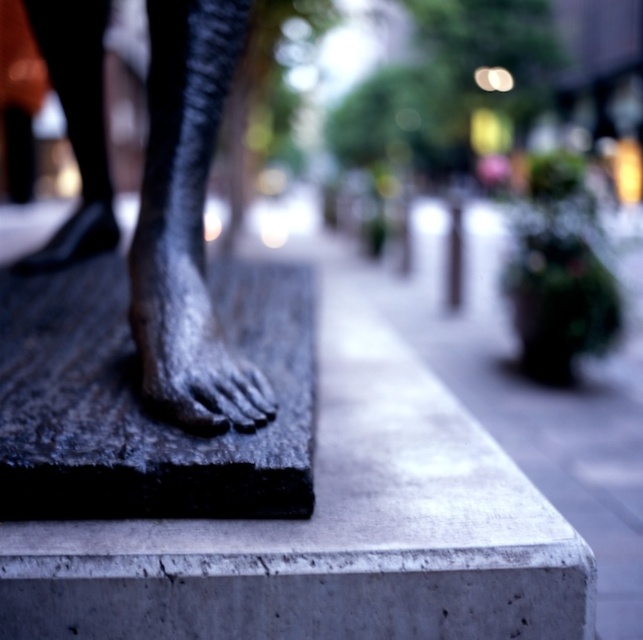
Based on the photo, you are an artist trying to place a small sculpture on the black granite slab at center. The bronze statue foot at center is already on the slab. Can you fit your sculpture next to it without overlapping?

The bronze statue foot at center has a lesser width compared to the black granite slab at center, so there might be enough space left on the slab to place your small sculpture next to it without overlapping.

You are a photographer adjusting your camera to focus on the sculpture in the image. You notice two points marked in the scene. Which of the two points, point (168, 157) or point (530, 451), is closer to your camera lens?

Point (168, 157) is closer to the viewer than point (530, 451), so it is the closer point to focus on.